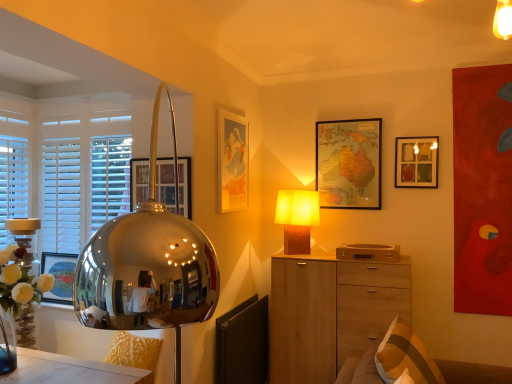
Image resolution: width=512 pixels, height=384 pixels. What are the coordinates of `free space above white wooden blinds at left (from a real-world perspective)` in the screenshot? It's located at (78, 88).